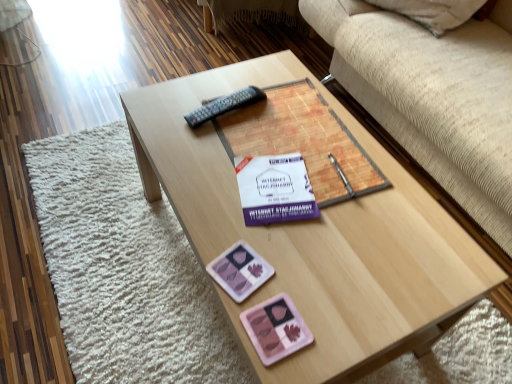
The width and height of the screenshot is (512, 384). Find the location of `vacant point to the left of black plastic remote at center`. vacant point to the left of black plastic remote at center is located at coordinates (173, 109).